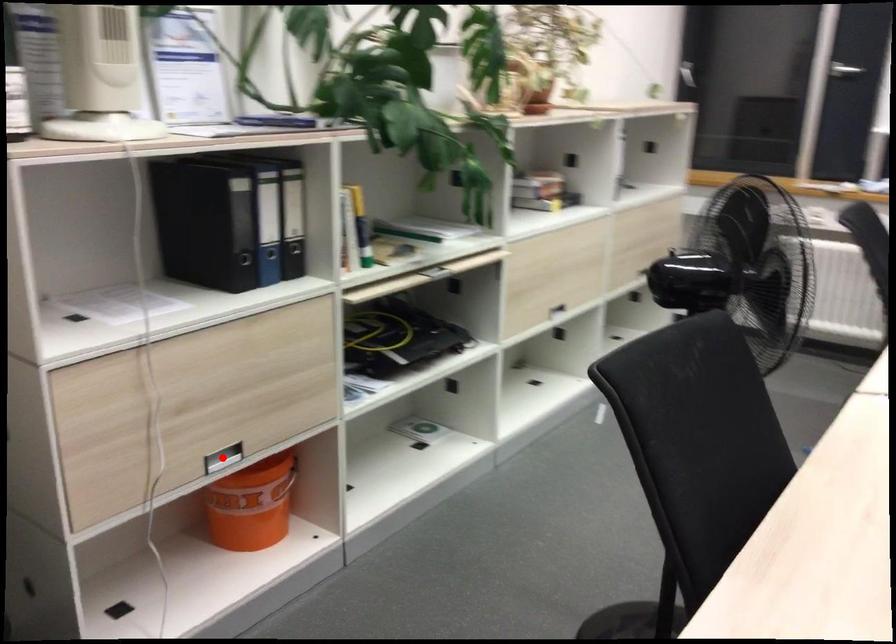
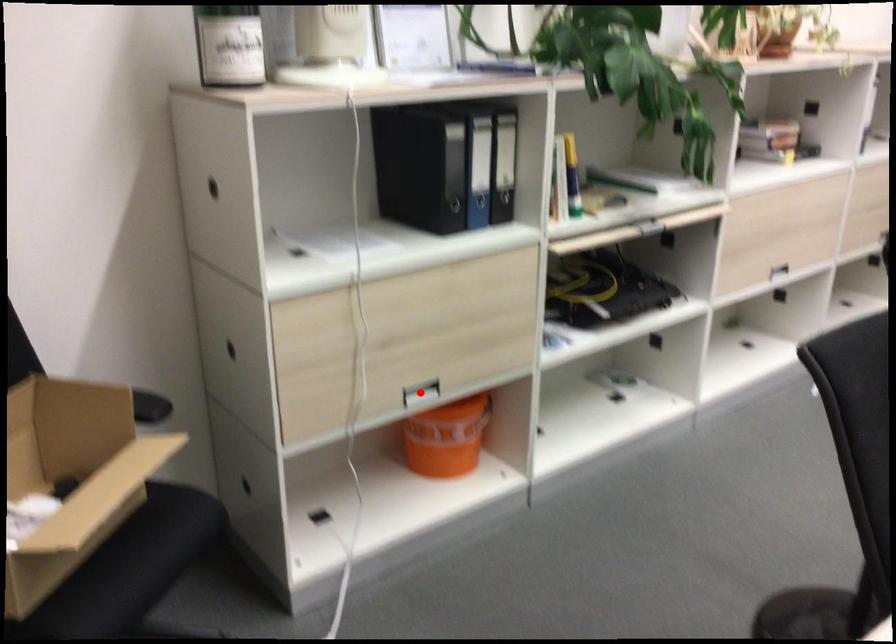
I am providing you with two images of the same scene from different viewpoints. A red point is marked on the first image and another point is marked on the second image. Does the point marked in image1 correspond to the same location as the one in image2?

Yes